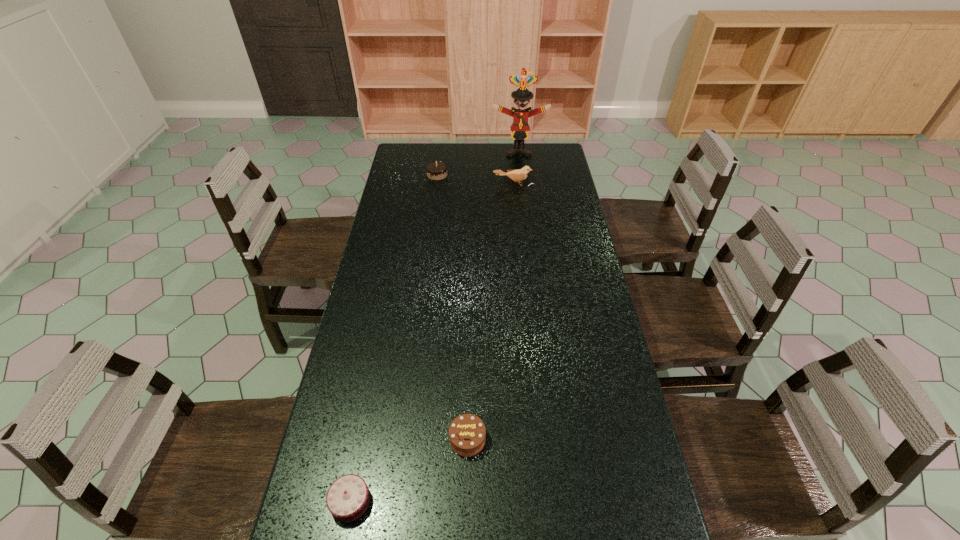
Locate an element on the screen. free space between the farthest object and the farthest chocolate cake is located at coordinates (478, 163).

I want to click on unoccupied position between the second farthest chocolate cake and the fourth object from right to left, so click(x=452, y=307).

Find the location of a particular element. unoccupied position between the tallest object and the nearest object is located at coordinates (435, 326).

You are a GUI agent. You are given a task and a screenshot of the screen. Output one action in this format:
    pyautogui.click(x=<x>, y=<y>)
    Task: Click on the blank region between the second tallest object and the fourth object from right to left
    
    Given the screenshot: What is the action you would take?
    pyautogui.click(x=475, y=180)

This screenshot has height=540, width=960. In order to click on empty space between the second nearest chocolate cake and the leftmost object in this screenshot , I will do `click(409, 470)`.

In order to click on empty location between the second chocolate cake from right to left and the tallest object in this screenshot , I will do `click(478, 163)`.

This screenshot has width=960, height=540. What are the coordinates of `object that is the fourth closest to the tallest object` in the screenshot? It's located at (348, 497).

Identify which object is the fourth closest to the farthest object. Please provide its 2D coordinates. Your answer should be formatted as a tuple, i.e. [(x, y)], where the tuple contains the x and y coordinates of a point satisfying the conditions above.

[(348, 497)]

Identify which chocolate cake is the second closest to the bird. Please provide its 2D coordinates. Your answer should be formatted as a tuple, i.e. [(x, y)], where the tuple contains the x and y coordinates of a point satisfying the conditions above.

[(467, 432)]

Select which chocolate cake appears as the second closest to the second nearest object. Please provide its 2D coordinates. Your answer should be formatted as a tuple, i.e. [(x, y)], where the tuple contains the x and y coordinates of a point satisfying the conditions above.

[(436, 170)]